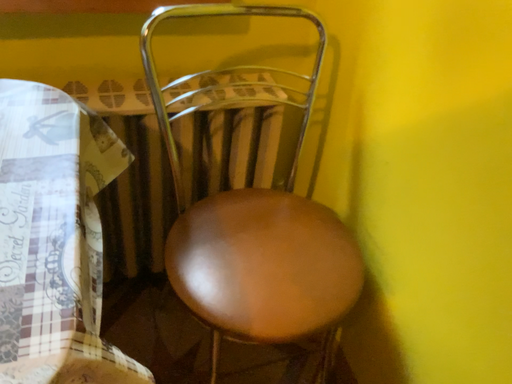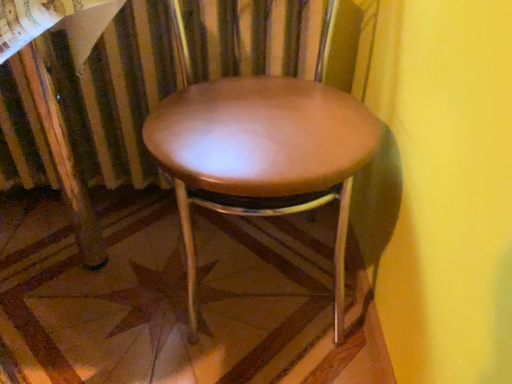
Question: Which way did the camera rotate in the video?

Choices:
 (A) rotated left
 (B) rotated right

Answer: (A)